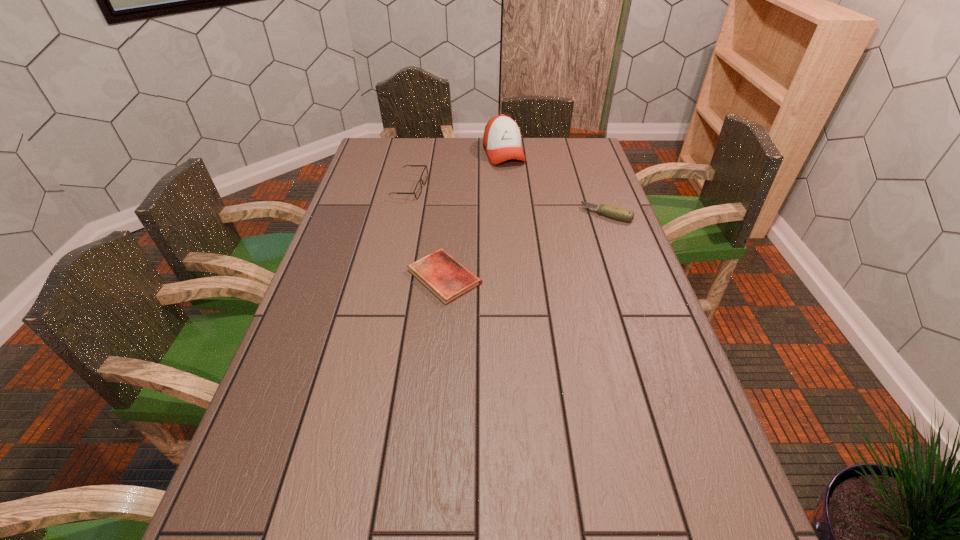
Find the location of a particular element. This screenshot has height=540, width=960. free area in between the third nearest object and the second shortest object is located at coordinates (508, 201).

You are a GUI agent. You are given a task and a screenshot of the screen. Output one action in this format:
    pyautogui.click(x=<x>, y=<y>)
    Task: Click on the free spot between the nearest object and the third shortest object
    The height and width of the screenshot is (540, 960).
    Given the screenshot: What is the action you would take?
    pyautogui.click(x=427, y=233)

In order to click on vacant space in between the third nearest object and the farthest object in this screenshot , I will do `click(457, 171)`.

You are a GUI agent. You are given a task and a screenshot of the screen. Output one action in this format:
    pyautogui.click(x=<x>, y=<y>)
    Task: Click on the empty space that is in between the diary and the second nearest object
    This screenshot has width=960, height=540.
    Given the screenshot: What is the action you would take?
    pyautogui.click(x=526, y=246)

Where is `object that is the closest one to the diary`? Image resolution: width=960 pixels, height=540 pixels. object that is the closest one to the diary is located at coordinates (418, 189).

Point out which object is positioned as the second nearest to the farthest object. Please provide its 2D coordinates. Your answer should be formatted as a tuple, i.e. [(x, y)], where the tuple contains the x and y coordinates of a point satisfying the conditions above.

[(614, 212)]

You are a GUI agent. You are given a task and a screenshot of the screen. Output one action in this format:
    pyautogui.click(x=<x>, y=<y>)
    Task: Click on the vacant region that satisfies the following two spatial constraints: 1. on the front side of the baseball cap; 2. on the right side of the pocketknife
    
    Given the screenshot: What is the action you would take?
    pyautogui.click(x=510, y=214)